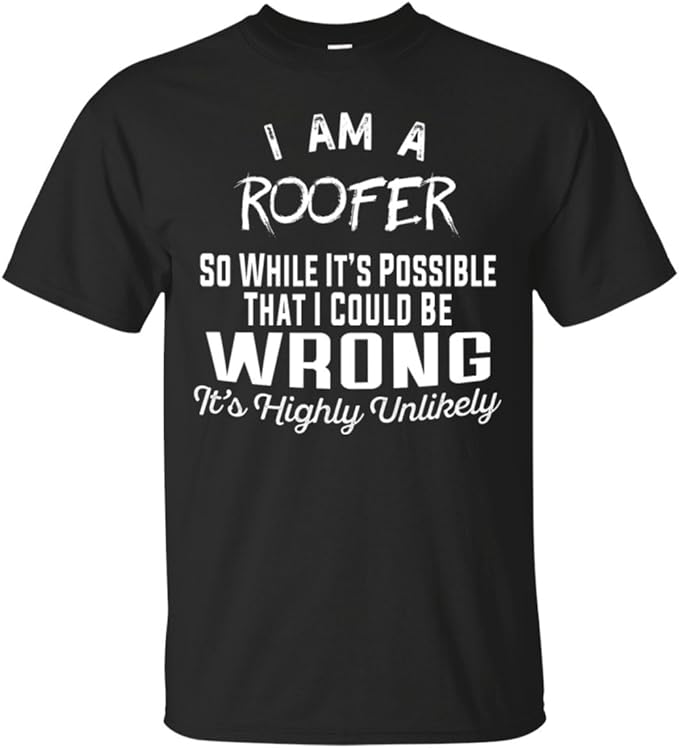
Where is `fabric`? This screenshot has width=679, height=748. fabric is located at coordinates (464, 675).